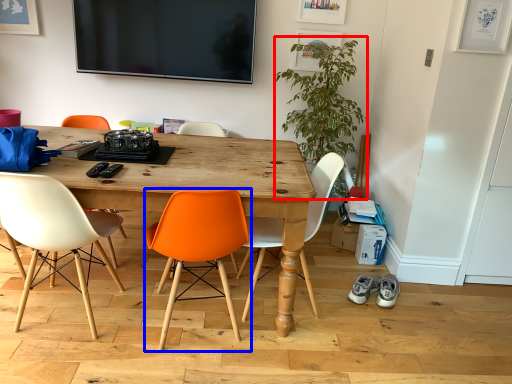
Question: Which object appears closest to the camera in this image, plant (highlighted by a red box) or chair (highlighted by a blue box)?

Choices:
 (A) plant
 (B) chair

Answer: (B)